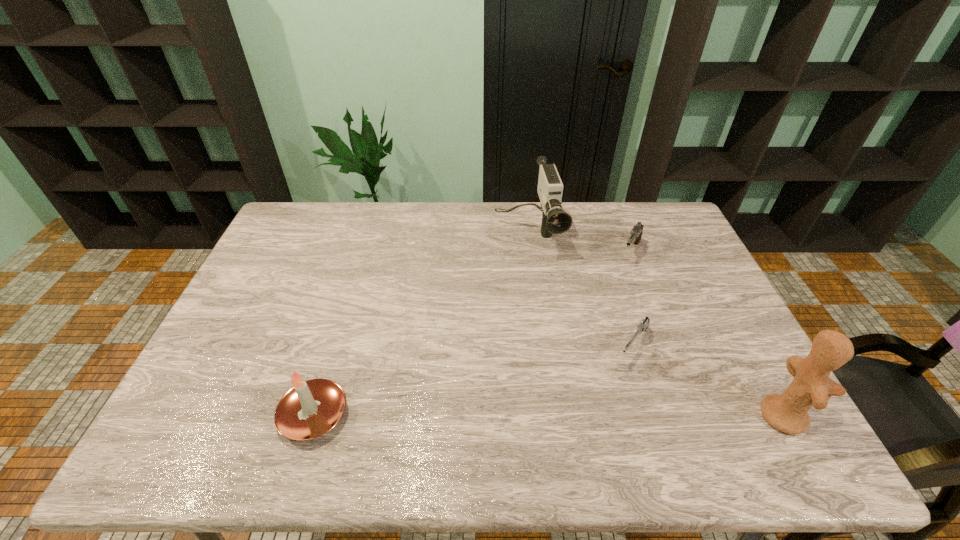
Locate an element on the screen. The image size is (960, 540). vacant space on the desktop that is between the leftmost object and the figurine and is positioned on the front-facing side of the shorter pistol is located at coordinates (585, 415).

Find the location of a particular element. The height and width of the screenshot is (540, 960). free space on the desktop that is between the leftmost object and the tallest object and is positioned on the recording direction of the fourth object from right to left is located at coordinates (573, 415).

Identify the location of free spot on the desktop that is between the leftmost object and the rightmost object and is positioned at the barrel of the second shortest object. (542, 415).